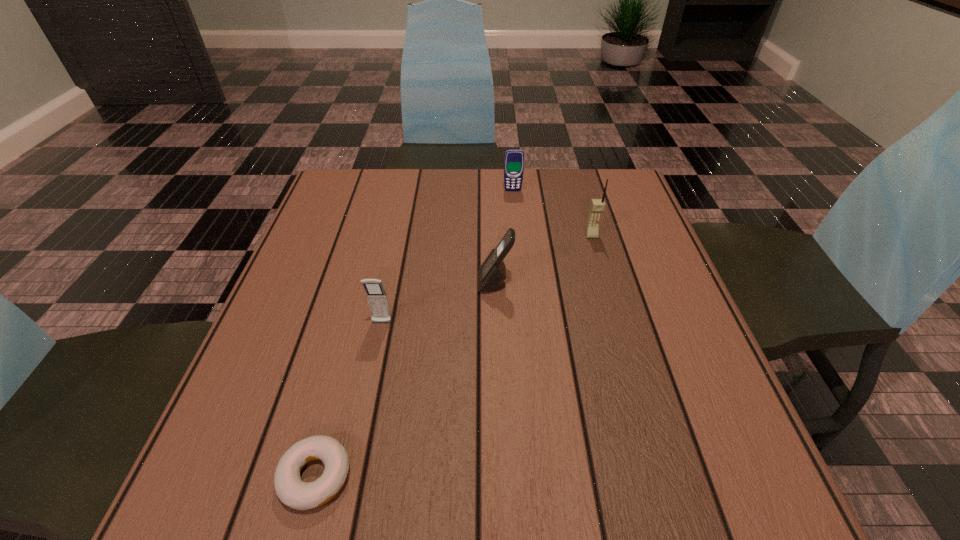
In the image, there is a desktop. Where is `vacant space at the far edge`? The width and height of the screenshot is (960, 540). vacant space at the far edge is located at coordinates (533, 199).

This screenshot has width=960, height=540. I want to click on vacant space at the left edge of the desktop, so click(350, 275).

Identify the location of vacant region at the right edge. The image size is (960, 540). (639, 227).

Locate an element on the screen. vacant space at the far right corner is located at coordinates (627, 199).

This screenshot has width=960, height=540. Find the location of `empty space that is in between the third farthest object and the shortest object`. empty space that is in between the third farthest object and the shortest object is located at coordinates (405, 380).

What are the coordinates of `empty location between the farthest object and the third farthest object` in the screenshot? It's located at (504, 237).

I want to click on vacant space in between the shortest object and the farthest cellular telephone, so click(414, 333).

Identify the location of free space that is in between the farthest cellular telephone and the nearest cellular telephone. (447, 256).

Locate an element on the screen. free space between the third nearest object and the leftmost cellular telephone is located at coordinates (439, 303).

The height and width of the screenshot is (540, 960). Find the location of `free space between the second nearest cellular telephone and the farthest object`. free space between the second nearest cellular telephone and the farthest object is located at coordinates (504, 237).